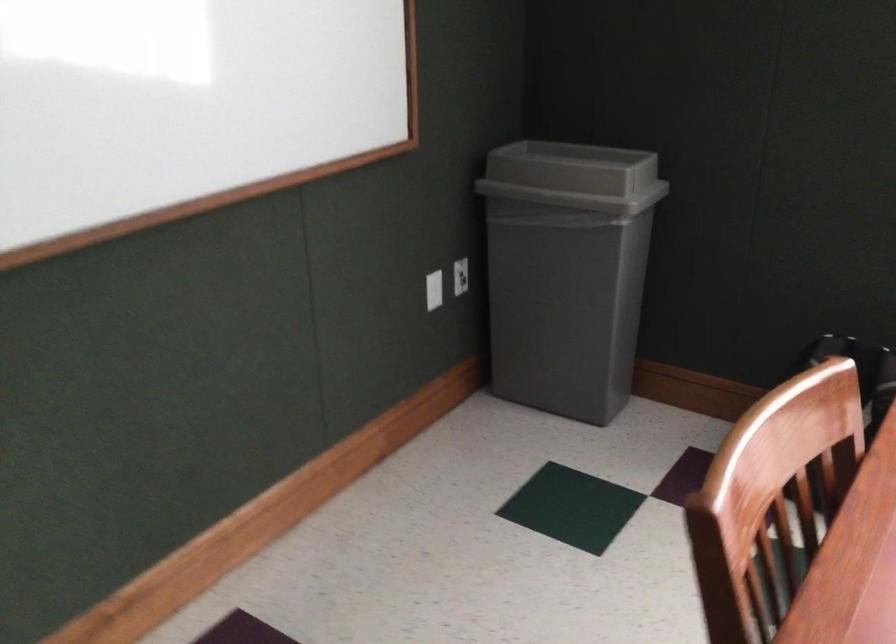
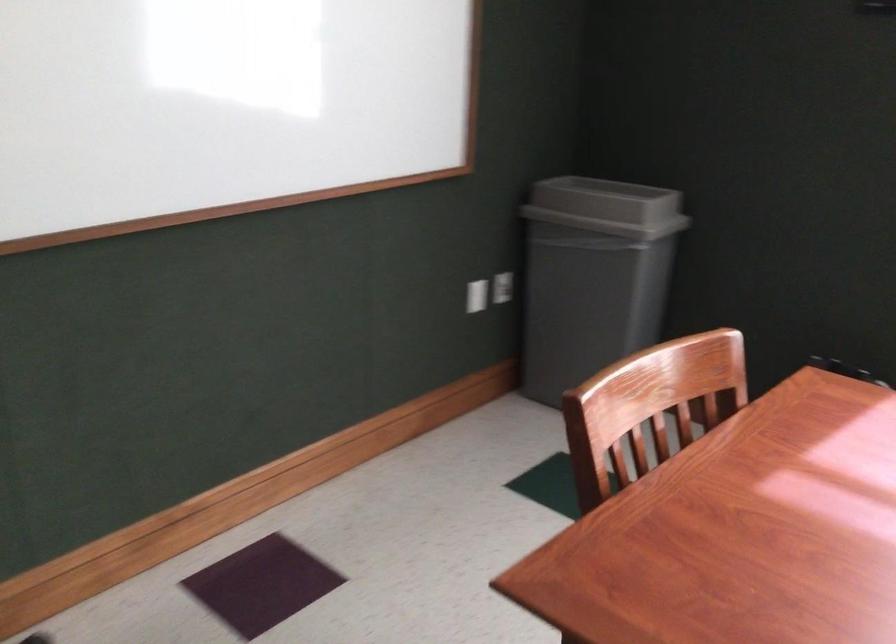
Where in the second image is the point corresponding to [435,290] from the first image?

(477, 295)